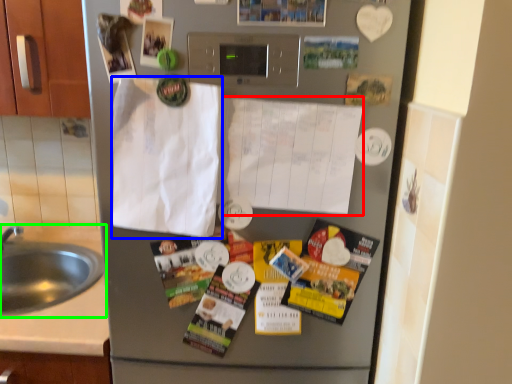
Question: Which object is the closest to the paper (highlighted by a red box)? Choose among these: envelope (highlighted by a blue box) or sink (highlighted by a green box).

Choices:
 (A) envelope
 (B) sink

Answer: (A)